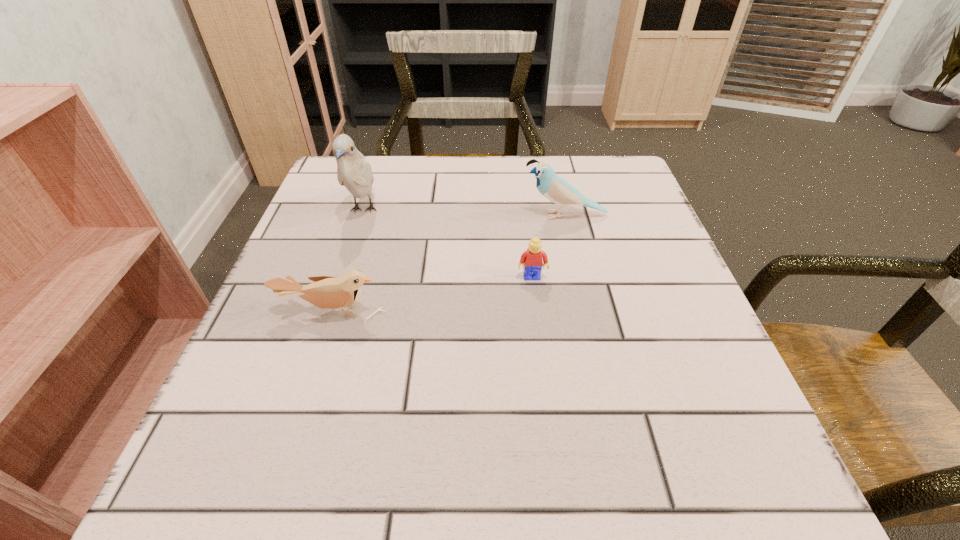
Identify the location of vacant area that lies between the second shortest bird and the tallest bird. (464, 213).

Where is `vacant space that is in between the Lego and the second shortest bird`? This screenshot has width=960, height=540. vacant space that is in between the Lego and the second shortest bird is located at coordinates (548, 246).

Identify the location of object identified as the second closest to the nearest object. (531, 260).

This screenshot has height=540, width=960. In order to click on object that can be found as the closest to the tallest bird in this screenshot , I will do `click(326, 292)`.

At what (x,y) coordinates should I click in order to perform the action: click on bird that is the closest to the rightmost bird. Please return your answer as a coordinate pair (x, y). Looking at the image, I should click on (354, 172).

The image size is (960, 540). I want to click on bird that stands as the second closest to the Lego, so click(326, 292).

The height and width of the screenshot is (540, 960). In order to click on vacant position in the image that satisfies the following two spatial constraints: 1. at the face of the second tallest object; 2. on the front-facing side of the second nearest object in this screenshot , I will do `click(579, 277)`.

Identify the location of vacant space that satisfies the following two spatial constraints: 1. at the face of the second shortest bird; 2. at the beak of the nearest object. This screenshot has width=960, height=540. (587, 312).

Where is `vacant area that satisfies the following two spatial constraints: 1. at the face of the second shortest bird; 2. on the front-facing side of the second nearest object`? This screenshot has height=540, width=960. vacant area that satisfies the following two spatial constraints: 1. at the face of the second shortest bird; 2. on the front-facing side of the second nearest object is located at coordinates (579, 277).

The image size is (960, 540). I want to click on vacant area in the image that satisfies the following two spatial constraints: 1. at the face of the rightmost bird; 2. at the beak of the nearest object, so click(x=587, y=312).